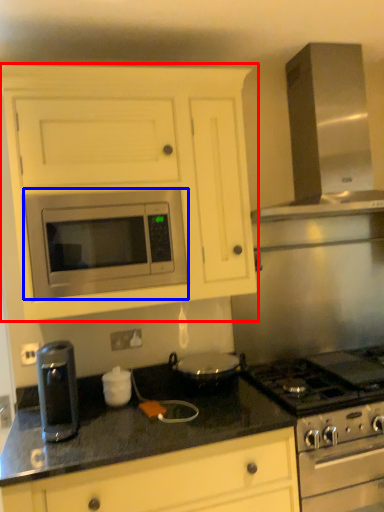
Question: Which object appears farthest to the camera in this image, cabinetry (highlighted by a red box) or microwave oven (highlighted by a blue box)?

Choices:
 (A) cabinetry
 (B) microwave oven

Answer: (B)